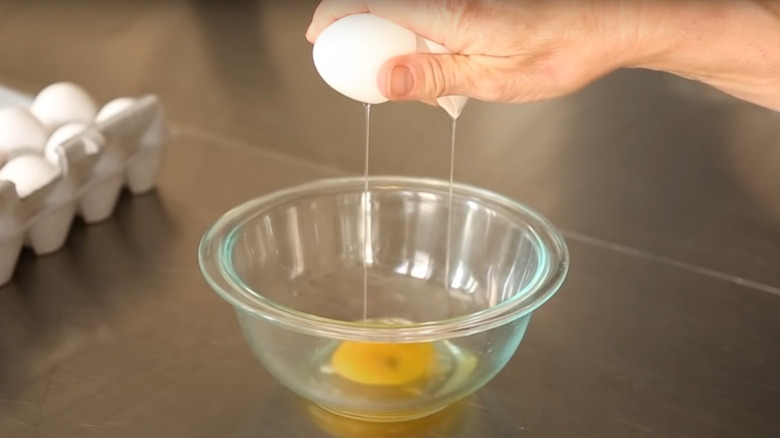
I want to click on glass bowl with egg in it, so click(x=541, y=297).